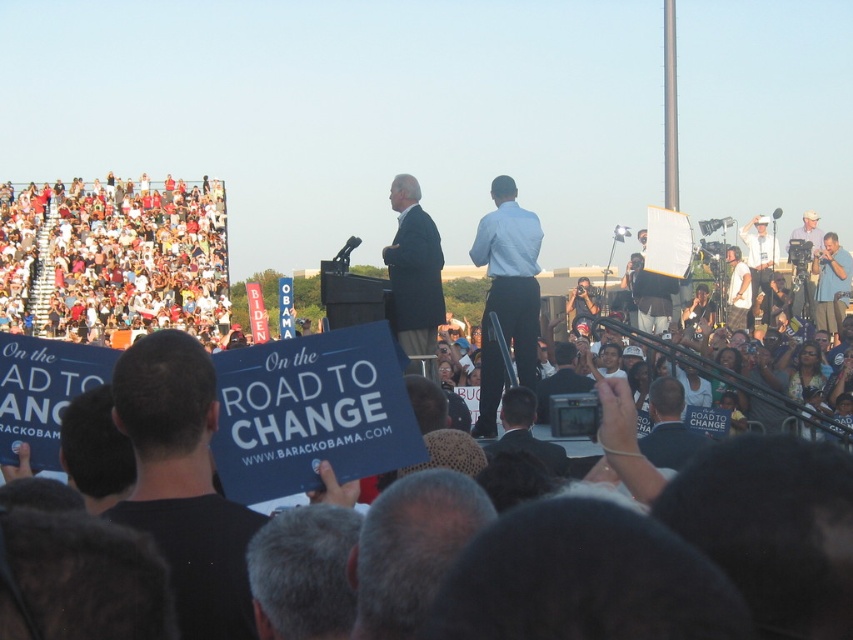
Question: Based on their relative distances, which object is farther from the gray hair at center?

Choices:
 (A) white cotton crowd at upper left
 (B) blue shirt at right
 (C) black fabric shirt at lower left

Answer: (B)

Question: Does blue shirt at right appear under white cotton shirt at upper right?

Choices:
 (A) no
 (B) yes

Answer: (B)

Question: Among these points, which one is farthest from the camera?

Choices:
 (A) (206, 508)
 (B) (746, 289)
 (C) (703, 442)
 (D) (416, 250)

Answer: (B)

Question: Does blue shirt at right have a greater width compared to white cotton shirt at upper right?

Choices:
 (A) no
 (B) yes

Answer: (B)

Question: Can you confirm if white cotton crowd at upper left is positioned below dark suit at center?

Choices:
 (A) yes
 (B) no

Answer: (B)

Question: Among these points, which one is farthest from the camera?

Choices:
 (A) (656, 429)
 (B) (820, 276)
 (C) (550, 442)
 (D) (747, 280)

Answer: (D)